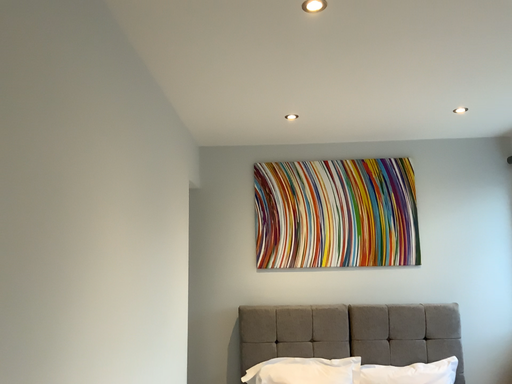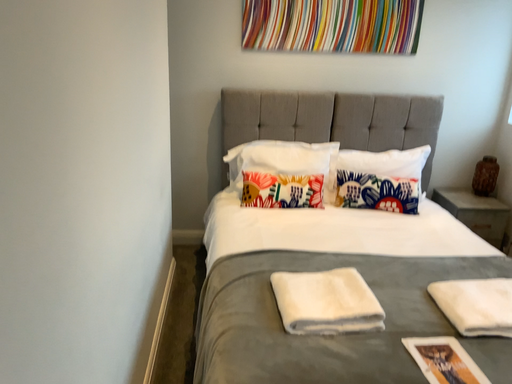
Question: Which way did the camera rotate in the video?

Choices:
 (A) rotated downward
 (B) rotated upward

Answer: (A)